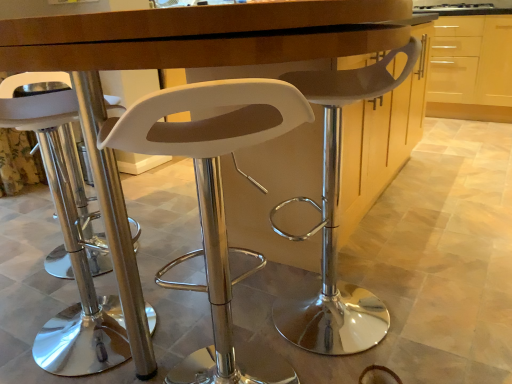
You are a GUI agent. You are given a task and a screenshot of the screen. Output one action in this format:
    pyautogui.click(x=<x>, y=<y>)
    Task: Click on the free spot to the right of white plastic stool at left, positioned as the 3th chair in right-to-left order
    The width and height of the screenshot is (512, 384).
    Given the screenshot: What is the action you would take?
    pyautogui.click(x=195, y=323)